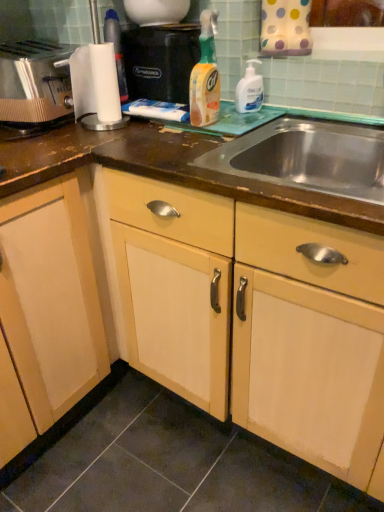
Question: Is black plastic coffee machine at upper center positioned far away from stainless steel sink at center?

Choices:
 (A) yes
 (B) no

Answer: (B)

Question: From the image's perspective, is black plastic coffee machine at upper center above stainless steel sink at center?

Choices:
 (A) no
 (B) yes

Answer: (B)

Question: Does black plastic coffee machine at upper center come in front of stainless steel sink at center?

Choices:
 (A) no
 (B) yes

Answer: (A)

Question: Is black plastic coffee machine at upper center wider than stainless steel sink at center?

Choices:
 (A) yes
 (B) no

Answer: (B)

Question: Considering the relative sizes of black plastic coffee machine at upper center and stainless steel sink at center in the image provided, is black plastic coffee machine at upper center bigger than stainless steel sink at center?

Choices:
 (A) no
 (B) yes

Answer: (A)

Question: Visually, is stainless steel sink at center positioned to the left or to the right of translucent plastic spray bottle at center, which is the second cleaning product from right to left?

Choices:
 (A) left
 (B) right

Answer: (B)

Question: Looking at their shapes, would you say stainless steel sink at center is wider or thinner than translucent plastic spray bottle at center, arranged as the first cleaning product when viewed from the left?

Choices:
 (A) wide
 (B) thin

Answer: (A)

Question: From a real-world perspective, is stainless steel sink at center positioned above or below translucent plastic spray bottle at center, which is the second cleaning product from right to left?

Choices:
 (A) below
 (B) above

Answer: (A)

Question: Is point (340, 184) closer or farther from the camera than point (203, 53)?

Choices:
 (A) farther
 (B) closer

Answer: (B)

Question: Based on their positions, is matte wood cabinet at center located to the left or right of white glossy pump bottle at upper right, which ranks as the 2th cleaning product in left-to-right order?

Choices:
 (A) right
 (B) left

Answer: (B)

Question: Considering their positions, is matte wood cabinet at center located in front of or behind white glossy pump bottle at upper right, acting as the 1th cleaning product starting from the right?

Choices:
 (A) front
 (B) behind

Answer: (A)

Question: From a real-world perspective, is matte wood cabinet at center above or below white glossy pump bottle at upper right, acting as the 1th cleaning product starting from the right?

Choices:
 (A) above
 (B) below

Answer: (B)

Question: Do you think matte wood cabinet at center is within white glossy pump bottle at upper right, acting as the 1th cleaning product starting from the right, or outside of it?

Choices:
 (A) inside
 (B) outside

Answer: (B)

Question: Looking at the image, does matte wood cabinet at center seem bigger or smaller compared to translucent plastic spray bottle at center, which is the second cleaning product from right to left?

Choices:
 (A) small
 (B) big

Answer: (B)

Question: In terms of height, does matte wood cabinet at center look taller or shorter compared to translucent plastic spray bottle at center, which is the second cleaning product from right to left?

Choices:
 (A) tall
 (B) short

Answer: (A)